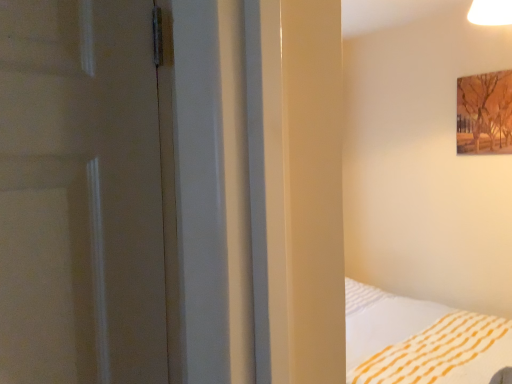
What are the coordinates of `wooden painting at upper right` in the screenshot? It's located at (484, 113).

The width and height of the screenshot is (512, 384). Describe the element at coordinates (484, 113) in the screenshot. I see `wooden painting at upper right` at that location.

What is the approximate width of wooden painting at upper right?

wooden painting at upper right is 1.77 inches in width.

The image size is (512, 384). I want to click on wooden painting at upper right, so click(484, 113).